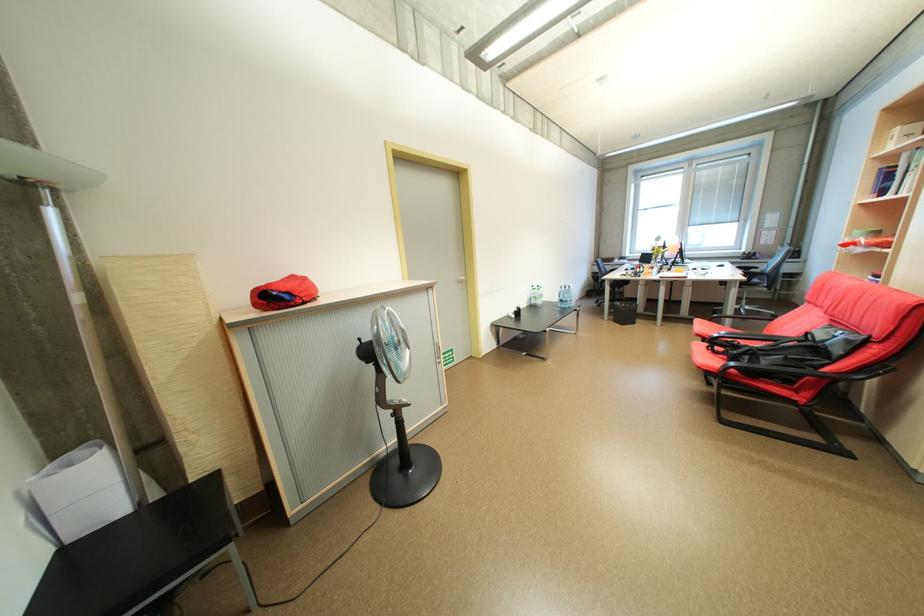
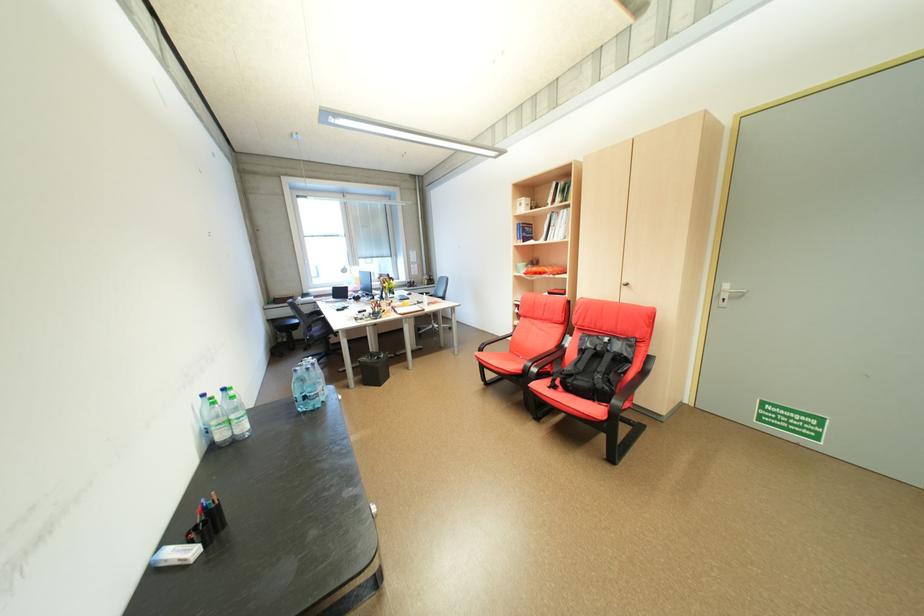
Where in the second image is the point corresponding to (x=570, y=301) from the first image?

(313, 398)